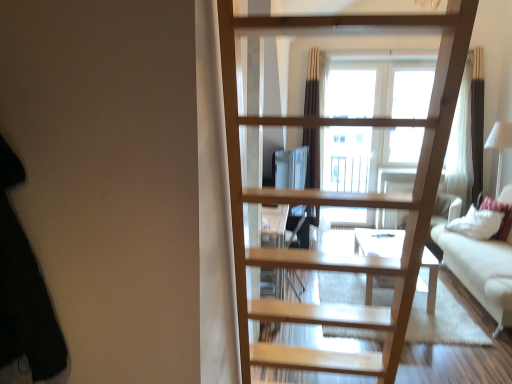
Question: From the image's perspective, is black fabric at left on top of natural wood ladder at center?

Choices:
 (A) yes
 (B) no

Answer: (A)

Question: Is natural wood ladder at center located within black fabric at left?

Choices:
 (A) no
 (B) yes

Answer: (A)

Question: Is black fabric at left oriented away from natural wood ladder at center?

Choices:
 (A) no
 (B) yes

Answer: (A)

Question: From a real-world perspective, is black fabric at left physically below natural wood ladder at center?

Choices:
 (A) no
 (B) yes

Answer: (A)

Question: Is black fabric at left at the right side of natural wood ladder at center?

Choices:
 (A) no
 (B) yes

Answer: (A)

Question: Looking at their shapes, would you say natural wood ladder at center is wider or thinner than black fabric at left?

Choices:
 (A) thin
 (B) wide

Answer: (B)

Question: From a real-world perspective, is natural wood ladder at center physically located above or below black fabric at left?

Choices:
 (A) below
 (B) above

Answer: (A)

Question: Is natural wood ladder at center to the left or to the right of black fabric at left in the image?

Choices:
 (A) right
 (B) left

Answer: (A)

Question: Do you think natural wood ladder at center is within black fabric at left, or outside of it?

Choices:
 (A) inside
 (B) outside

Answer: (B)

Question: Considering the positions of point (502, 206) and point (507, 246), is point (502, 206) closer or farther from the camera than point (507, 246)?

Choices:
 (A) closer
 (B) farther

Answer: (B)

Question: Looking at their shapes, would you say white soft pillow at right is wider or thinner than white fabric couch at right?

Choices:
 (A) wide
 (B) thin

Answer: (B)

Question: Visually, is white soft pillow at right positioned to the left or to the right of white fabric couch at right?

Choices:
 (A) right
 (B) left

Answer: (A)

Question: Is white soft pillow at right in front of or behind white fabric couch at right in the image?

Choices:
 (A) behind
 (B) front

Answer: (A)

Question: Looking at the image, does black fabric at left seem bigger or smaller compared to white soft pillow at right?

Choices:
 (A) small
 (B) big

Answer: (A)

Question: Is point (8, 200) closer or farther from the camera than point (481, 193)?

Choices:
 (A) farther
 (B) closer

Answer: (B)